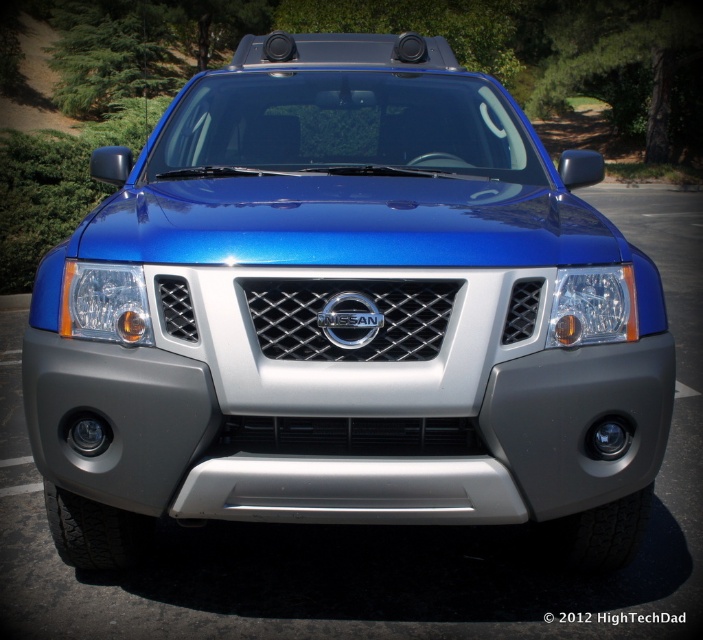
Question: Which point appears closest to the camera in this image?

Choices:
 (A) (58, 323)
 (B) (548, 346)

Answer: (B)

Question: Which point is closer to the camera?

Choices:
 (A) (612, 312)
 (B) (72, 307)

Answer: (B)

Question: Can you confirm if translucent plastic headlight at left is positioned to the right of clear plastic headlight at center-right?

Choices:
 (A) no
 (B) yes

Answer: (A)

Question: Is translucent plastic headlight at left to the right of clear plastic headlight at center-right from the viewer's perspective?

Choices:
 (A) yes
 (B) no

Answer: (B)

Question: Does translucent plastic headlight at left have a greater width compared to clear plastic headlight at center-right?

Choices:
 (A) yes
 (B) no

Answer: (A)

Question: Which point appears closest to the camera in this image?

Choices:
 (A) (124, 320)
 (B) (569, 292)

Answer: (A)